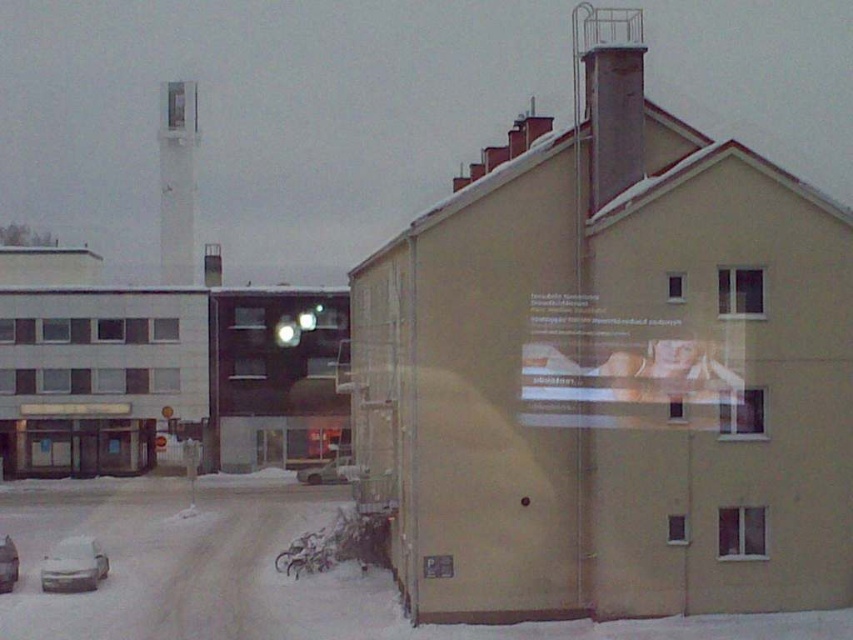
Question: Is the position of white glossy chimney at upper left less distant than that of silver metallic car at lower left?

Choices:
 (A) no
 (B) yes

Answer: (A)

Question: Considering the real-world distances, which object is farthest from the white glossy chimney at upper left?

Choices:
 (A) white matte car at lower left
 (B) silver metallic car at lower left

Answer: (B)

Question: Observing the image, what is the correct spatial positioning of white glossy chimney at upper left in reference to white matte car at lower left?

Choices:
 (A) above
 (B) below

Answer: (A)

Question: Which object is farther from the camera taking this photo?

Choices:
 (A) silver metallic car at lower left
 (B) white glossy chimney at upper left
 (C) white matte car at lower left

Answer: (B)

Question: Among these objects, which one is nearest to the camera?

Choices:
 (A) silver metallic car at lower left
 (B) white matte car at lower left

Answer: (B)

Question: Can you confirm if white glossy chimney at upper left is positioned to the right of white matte car at lower left?

Choices:
 (A) no
 (B) yes

Answer: (A)